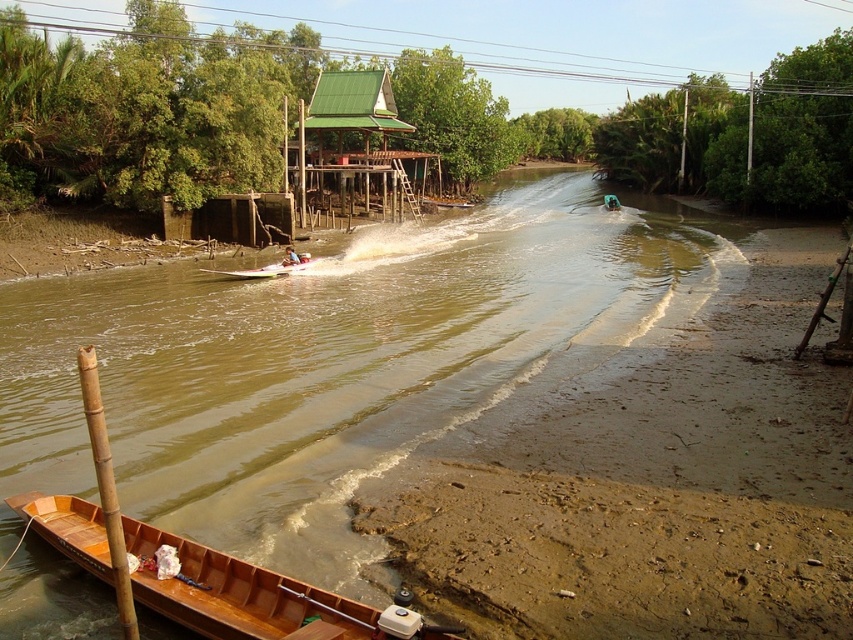
Does wooden boat at lower left have a greater height compared to light blue fabric shirt at center?

Incorrect, wooden boat at lower left's height is not larger of light blue fabric shirt at center's.

Can you confirm if wooden boat at lower left is thinner than light blue fabric shirt at center?

Incorrect, wooden boat at lower left's width is not less than light blue fabric shirt at center's.

Which is in front, point (204, 618) or point (291, 256)?

Positioned in front is point (204, 618).

Where is `wooden boat at lower left`? This screenshot has width=853, height=640. wooden boat at lower left is located at coordinates (239, 595).

Does brown wooden river at center appear on the left side of wooden boat at lower left?

Incorrect, brown wooden river at center is not on the left side of wooden boat at lower left.

Is brown wooden river at center below wooden boat at lower left?

Actually, brown wooden river at center is above wooden boat at lower left.

Between point (422, 432) and point (279, 602), which one is positioned behind?

The point (422, 432) is more distant.

Identify the location of brown wooden river at center. The width and height of the screenshot is (853, 640). (328, 362).

Who is more forward, (339,428) or (296,257)?

Point (339,428) is more forward.

Based on the photo, can you confirm if brown wooden river at center is positioned to the left of light blue fabric shirt at center?

In fact, brown wooden river at center is to the right of light blue fabric shirt at center.

Between point (15, 300) and point (288, 248), which one is positioned in front?

Point (15, 300)

In order to click on brown wooden river at center in this screenshot , I will do `click(328, 362)`.